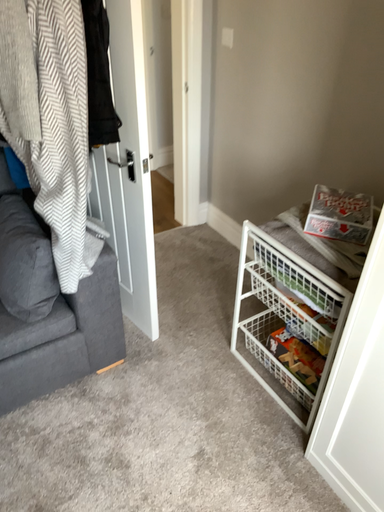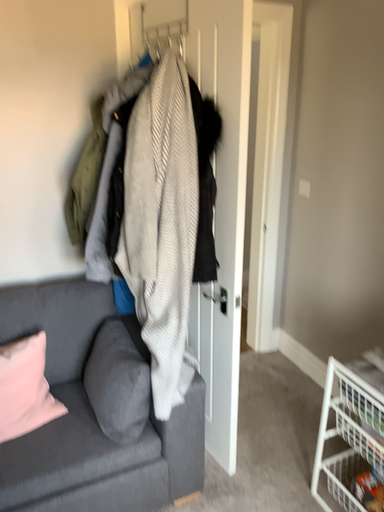
Question: How did the camera likely rotate when shooting the video?

Choices:
 (A) rotated upward
 (B) rotated downward

Answer: (A)